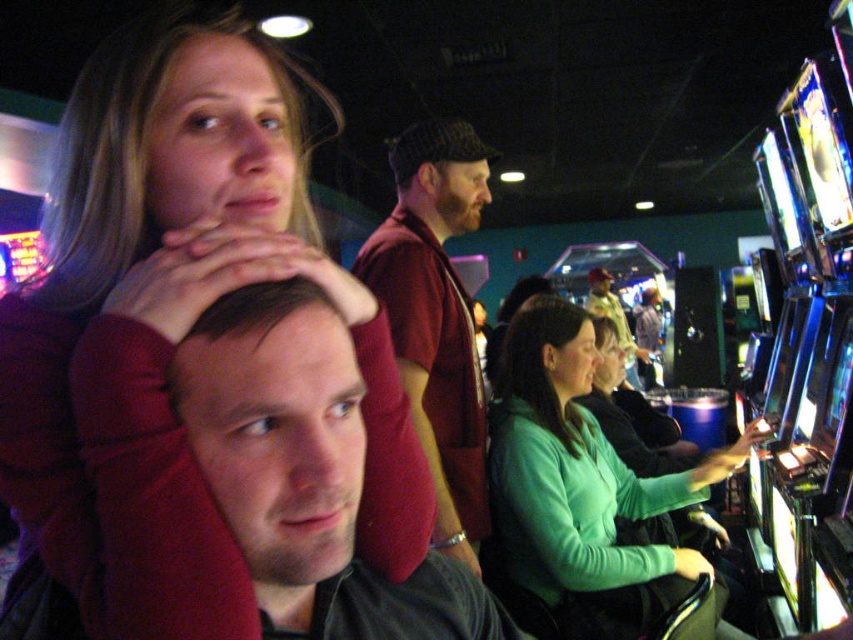
You are a photographer standing in the arcade and want to take a photo of the matte black shirt at center and the maroon sweater at center. Which one do you need to focus on first if you want to capture both clearly in the same frame?

The matte black shirt at center is located below the maroon sweater at center. Since the maroon sweater at center is higher up, you should focus on it first to ensure both are in focus as the matte black shirt at center is positioned lower.

You are standing in the arcade and want to find the matte black shirt at center. According to the coordinates provided, where should you look relative to the center of the image?

The matte black shirt at center is located at coordinates point 0.741 on the x axis and 0.360 on the y axis relative to the center of the image.